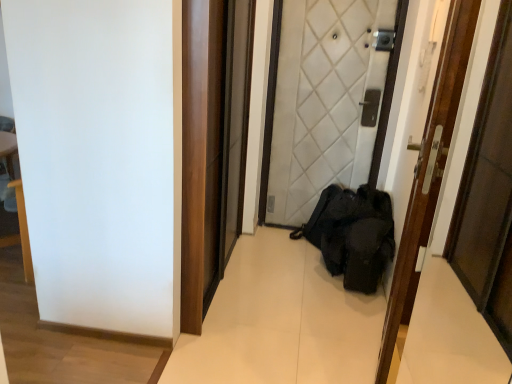
This screenshot has height=384, width=512. What do you see at coordinates (428, 176) in the screenshot?
I see `wooden door at center, which is the second door in back-to-front order` at bounding box center [428, 176].

The height and width of the screenshot is (384, 512). In order to click on wooden door at center, which is the second door in back-to-front order in this screenshot , I will do `click(428, 176)`.

Measure the distance between point [426,189] and camera.

They are 4.22 feet apart.

The image size is (512, 384). What do you see at coordinates (329, 100) in the screenshot?
I see `white quilted fabric door at center, the 1th door when ordered from back to front` at bounding box center [329, 100].

Locate an element on the screen. white quilted fabric door at center, the 1th door when ordered from back to front is located at coordinates (329, 100).

Measure the distance between white quilted fabric door at center, which is the second door from front to back, and camera.

white quilted fabric door at center, which is the second door from front to back, and camera are 8.61 feet apart from each other.

You are a GUI agent. You are given a task and a screenshot of the screen. Output one action in this format:
    pyautogui.click(x=<x>, y=<y>)
    Task: Click on the wooden door at center, the 1th door in the front-to-back sequence
    Image resolution: width=512 pixels, height=384 pixels.
    Given the screenshot: What is the action you would take?
    pyautogui.click(x=428, y=176)

Does white quilted fabric door at center, the 1th door when ordered from back to front, appear on the left side of wooden door at center, which is the second door in back-to-front order?

Correct, you'll find white quilted fabric door at center, the 1th door when ordered from back to front, to the left of wooden door at center, which is the second door in back-to-front order.

Which object is more forward, white quilted fabric door at center, the 1th door when ordered from back to front, or wooden door at center, which is the second door in back-to-front order?

wooden door at center, which is the second door in back-to-front order, is closer to the camera.

Considering the positions of points (369, 84) and (399, 294), is point (369, 84) closer to camera compared to point (399, 294)?

No, it is not.

From the image's perspective, is white quilted fabric door at center, the 1th door when ordered from back to front, over wooden door at center, the 1th door in the front-to-back sequence?

Yes, from the image's perspective, white quilted fabric door at center, the 1th door when ordered from back to front, is over wooden door at center, the 1th door in the front-to-back sequence.

Based on the photo, from a real-world perspective, is white quilted fabric door at center, the 1th door when ordered from back to front, physically located above or below wooden door at center, the 1th door in the front-to-back sequence?

white quilted fabric door at center, the 1th door when ordered from back to front, is situated higher than wooden door at center, the 1th door in the front-to-back sequence, in the real world.

Considering the sizes of white quilted fabric door at center, the 1th door when ordered from back to front, and wooden door at center, which is the second door in back-to-front order, in the image, is white quilted fabric door at center, the 1th door when ordered from back to front, wider or thinner than wooden door at center, which is the second door in back-to-front order,?

Clearly, white quilted fabric door at center, the 1th door when ordered from back to front, has more width compared to wooden door at center, which is the second door in back-to-front order.

Can you confirm if white quilted fabric door at center, which is the second door from front to back, is shorter than wooden door at center, the 1th door in the front-to-back sequence?

No.

Considering the sizes of objects white quilted fabric door at center, which is the second door from front to back, and wooden door at center, which is the second door in back-to-front order, in the image provided, who is bigger, white quilted fabric door at center, which is the second door from front to back, or wooden door at center, which is the second door in back-to-front order,?

With larger size is white quilted fabric door at center, which is the second door from front to back.

Is white quilted fabric door at center, which is the second door from front to back, outside of wooden door at center, which is the second door in back-to-front order?

white quilted fabric door at center, which is the second door from front to back, lies outside wooden door at center, which is the second door in back-to-front order,'s area.

Is there a large distance between white quilted fabric door at center, the 1th door when ordered from back to front, and wooden door at center, which is the second door in back-to-front order?

That's right, there is a large distance between white quilted fabric door at center, the 1th door when ordered from back to front, and wooden door at center, which is the second door in back-to-front order.

Does white quilted fabric door at center, the 1th door when ordered from back to front, turn towards wooden door at center, the 1th door in the front-to-back sequence?

Yes, white quilted fabric door at center, the 1th door when ordered from back to front, is oriented towards wooden door at center, the 1th door in the front-to-back sequence.

How many degrees apart are the facing directions of white quilted fabric door at center, the 1th door when ordered from back to front, and wooden door at center, which is the second door in back-to-front order?

They differ by 99.8 degrees in their facing directions.

How much distance is there between white quilted fabric door at center, the 1th door when ordered from back to front, and wooden door at center, the 1th door in the front-to-back sequence?

white quilted fabric door at center, the 1th door when ordered from back to front, is 4.88 feet from wooden door at center, the 1th door in the front-to-back sequence.

The height and width of the screenshot is (384, 512). I want to click on door in front of the white quilted fabric door at center, the 1th door when ordered from back to front, so click(428, 176).

Which object is positioned more to the left, wooden door at center, the 1th door in the front-to-back sequence, or white quilted fabric door at center, the 1th door when ordered from back to front?

Positioned to the left is white quilted fabric door at center, the 1th door when ordered from back to front.

Between wooden door at center, the 1th door in the front-to-back sequence, and white quilted fabric door at center, the 1th door when ordered from back to front, which one is positioned in front?

wooden door at center, the 1th door in the front-to-back sequence, is in front.

Is point (447, 57) closer to viewer compared to point (304, 13)?

Yes, point (447, 57) is in front of point (304, 13).

From the image's perspective, which object appears higher, wooden door at center, the 1th door in the front-to-back sequence, or white quilted fabric door at center, which is the second door from front to back?

From the image's view, white quilted fabric door at center, which is the second door from front to back, is above.

From a real-world perspective, is wooden door at center, which is the second door in back-to-front order, located higher than white quilted fabric door at center, the 1th door when ordered from back to front?

No, from a real-world perspective, wooden door at center, which is the second door in back-to-front order, is not over white quilted fabric door at center, the 1th door when ordered from back to front

Looking at their sizes, would you say wooden door at center, the 1th door in the front-to-back sequence, is wider or thinner than white quilted fabric door at center, the 1th door when ordered from back to front?

In the image, wooden door at center, the 1th door in the front-to-back sequence, appears to be more narrow than white quilted fabric door at center, the 1th door when ordered from back to front.

Considering the sizes of objects wooden door at center, the 1th door in the front-to-back sequence, and white quilted fabric door at center, the 1th door when ordered from back to front, in the image provided, who is taller, wooden door at center, the 1th door in the front-to-back sequence, or white quilted fabric door at center, the 1th door when ordered from back to front,?

With more height is white quilted fabric door at center, the 1th door when ordered from back to front.

Which of these two, wooden door at center, the 1th door in the front-to-back sequence, or white quilted fabric door at center, the 1th door when ordered from back to front, is smaller?

With smaller size is wooden door at center, the 1th door in the front-to-back sequence.

Which is correct: wooden door at center, which is the second door in back-to-front order, is inside white quilted fabric door at center, the 1th door when ordered from back to front, or outside of it?

wooden door at center, which is the second door in back-to-front order, exists outside the volume of white quilted fabric door at center, the 1th door when ordered from back to front.

Based on the photo, is wooden door at center, which is the second door in back-to-front order, not near white quilted fabric door at center, which is the second door from front to back?

That's right, there is a large distance between wooden door at center, which is the second door in back-to-front order, and white quilted fabric door at center, which is the second door from front to back.

Could you tell me if wooden door at center, which is the second door in back-to-front order, is facing white quilted fabric door at center, which is the second door from front to back?

No.

How distant is wooden door at center, which is the second door in back-to-front order, from white quilted fabric door at center, which is the second door from front to back?

4.88 feet.

Locate an element on the screen. door that appears above the wooden door at center, which is the second door in back-to-front order (from a real-world perspective) is located at coordinates (329, 100).

This screenshot has height=384, width=512. Find the location of `door on the right side of white quilted fabric door at center, the 1th door when ordered from back to front`. door on the right side of white quilted fabric door at center, the 1th door when ordered from back to front is located at coordinates (428, 176).

Identify the location of door above the wooden door at center, the 1th door in the front-to-back sequence (from a real-world perspective). pos(329,100).